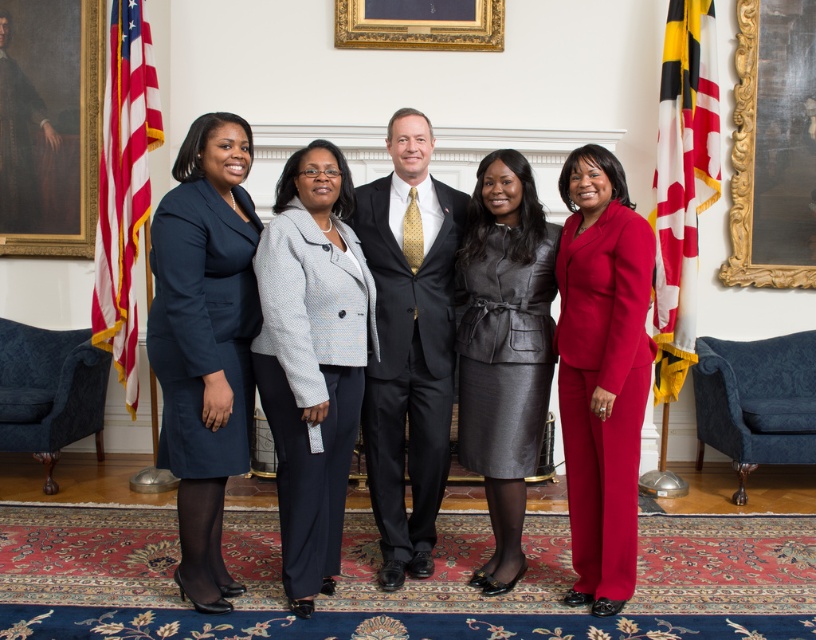
You are a photographer adjusting the lighting for a group photo. You need to ensure that the matte red suit at right and the black suit at center are both visible in the final image. Considering their widths, which suit requires more careful lighting to avoid being overshadowed?

The matte red suit at right is thinner than the black suit at center, so the matte red suit at right requires more careful lighting to avoid being overshadowed due to its narrower width.

You are standing in front of the group photo and notice the black suit at center and the wooden portrait frame at left. Which object is positioned lower in the image?

The black suit at center is positioned below the wooden portrait frame at left, so it is lower in the image.

In the formal group photo, you notice two people wearing the light gray textured blazer at center and the black suit at center. Which of these two items of clothing appears narrower when viewed from the front?

The light gray textured blazer at center appears narrower than the black suit at center because it is thinner.